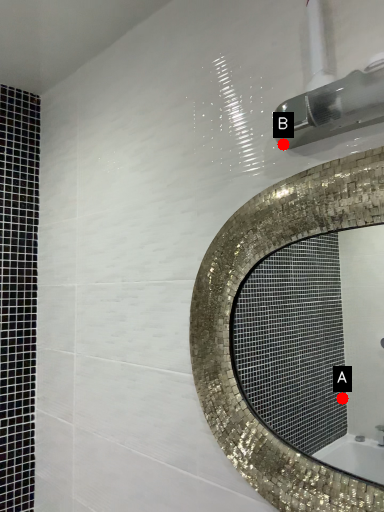
Question: Two points are circled on the image, labeled by A and B beside each circle. Among these points, which one is farthest from the camera?

Choices:
 (A) A is further
 (B) B is further

Answer: (A)